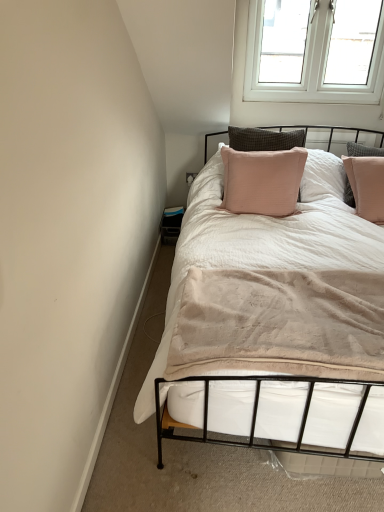
Question: From a real-world perspective, relative to pink fabric pillow at upper center, is white soft bed at center vertically above or below?

Choices:
 (A) below
 (B) above

Answer: (A)

Question: Considering their positions, is white soft bed at center located in front of or behind pink fabric pillow at upper center?

Choices:
 (A) behind
 (B) front

Answer: (B)

Question: Which of these objects is positioned closest to the white soft bed at center?

Choices:
 (A) white plastic window at upper right
 (B) pink fabric pillow at upper center

Answer: (A)

Question: Which is farther from the white plastic window at upper right?

Choices:
 (A) white soft bed at center
 (B) pink fabric pillow at upper center

Answer: (A)